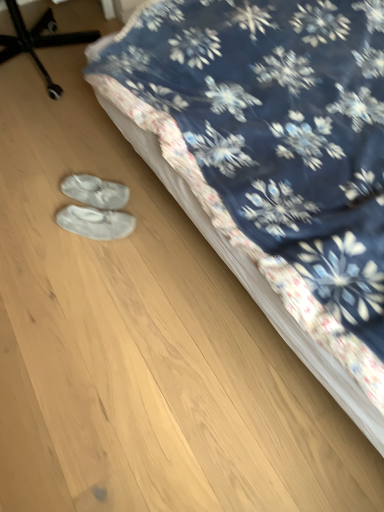
Where is `free spot below white suede slippers at lower center, the first footwear from the bottom (from a real-world perspective)`? free spot below white suede slippers at lower center, the first footwear from the bottom (from a real-world perspective) is located at coordinates (91, 227).